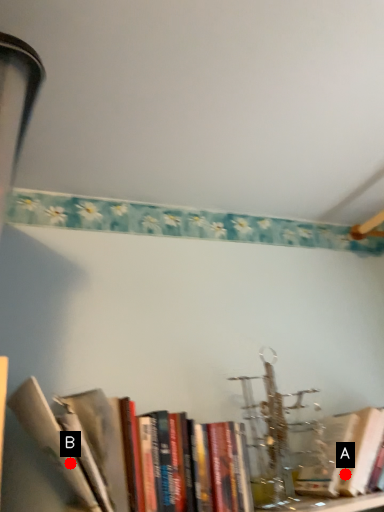
Question: Two points are circled on the image, labeled by A and B beside each circle. Which point is closer to the camera?

Choices:
 (A) A is closer
 (B) B is closer

Answer: (B)